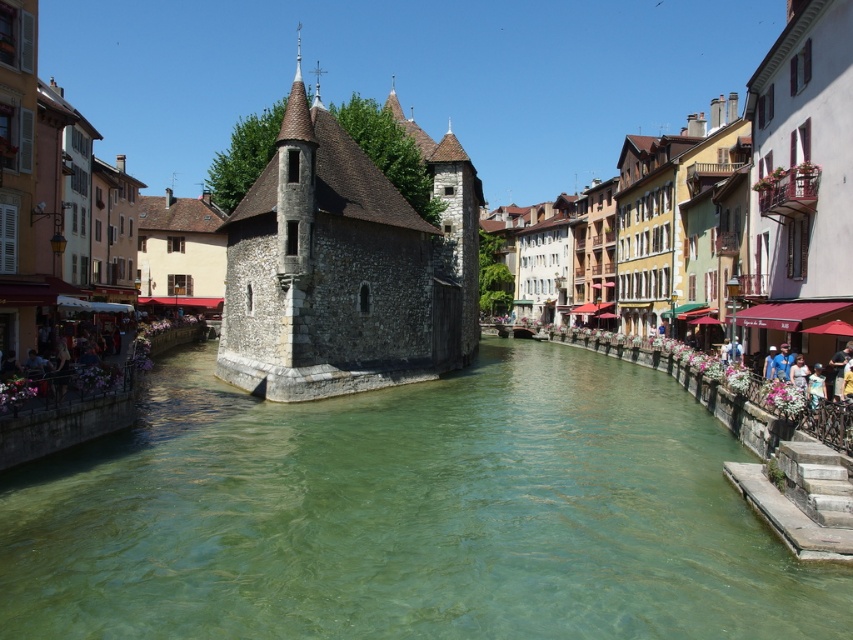
Does green stone water at center have a larger size compared to stone tower at center?

Incorrect, green stone water at center is not larger than stone tower at center.

Between green stone water at center and stone tower at center, which one is positioned lower?

Positioned lower is green stone water at center.

Is point (126, 595) positioned after point (410, 300)?

No, (126, 595) is closer to viewer.

Where is `green stone water at center`? Image resolution: width=853 pixels, height=640 pixels. green stone water at center is located at coordinates (407, 515).

Can you confirm if stone building at center is taller than stone tower at center?

Yes, stone building at center is taller than stone tower at center.

Can you confirm if stone building at center is wider than stone tower at center?

Yes, stone building at center is wider than stone tower at center.

Is point (578, 116) more distant than point (471, 342)?

That is True.

Where is `stone building at center`? The width and height of the screenshot is (853, 640). stone building at center is located at coordinates (407, 74).

Is green stone water at center wider than stone building at center?

No, green stone water at center is not wider than stone building at center.

Does green stone water at center come behind stone building at center?

No, green stone water at center is closer to the viewer.

You are a GUI agent. You are given a task and a screenshot of the screen. Output one action in this format:
    pyautogui.click(x=<x>, y=<y>)
    Task: Click on the green stone water at center
    This screenshot has height=640, width=853.
    Given the screenshot: What is the action you would take?
    pyautogui.click(x=407, y=515)